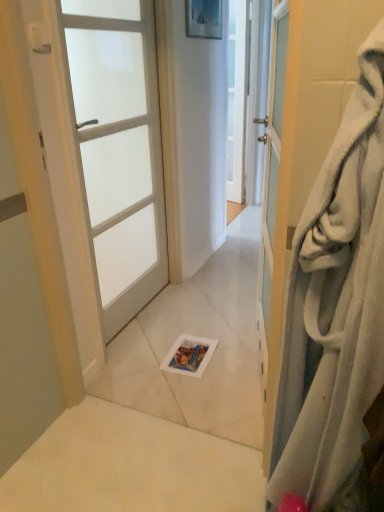
Question: Does white fabric door at right, which appears as the second door when viewed from the left, appear on the right side of white frosted glass door at left, acting as the 2th door starting from the front?

Choices:
 (A) yes
 (B) no

Answer: (A)

Question: Is white frosted glass door at left, which appears as the 2th door when viewed from the right, at the back of white fabric door at right, which appears as the second door when viewed from the left?

Choices:
 (A) yes
 (B) no

Answer: (B)

Question: Is white fabric door at right, which appears as the second door when viewed from the left, positioned far away from white frosted glass door at left, which is the first door in left-to-right order?

Choices:
 (A) yes
 (B) no

Answer: (A)

Question: Considering the relative sizes of white fabric door at right, which ranks as the 1th door in front-to-back order, and white frosted glass door at left, which is the first door in left-to-right order, in the image provided, is white fabric door at right, which ranks as the 1th door in front-to-back order, thinner than white frosted glass door at left, which is the first door in left-to-right order,?

Choices:
 (A) yes
 (B) no

Answer: (B)

Question: Is white fabric door at right, the second door viewed from the back, outside white frosted glass door at left, which appears as the 2th door when viewed from the right?

Choices:
 (A) no
 (B) yes

Answer: (B)

Question: From the image's perspective, is white fabric door at right, the second door viewed from the back, beneath white frosted glass door at left, which is the first door in left-to-right order?

Choices:
 (A) yes
 (B) no

Answer: (A)

Question: Can you confirm if white frosted glass door at left, which appears as the 2th door when viewed from the right, is shorter than white fabric door at right, the 1th door in the right-to-left sequence?

Choices:
 (A) no
 (B) yes

Answer: (A)

Question: From the image's perspective, is white frosted glass door at left, marked as the 1th door in a back-to-front arrangement, located beneath white fabric door at right, the 1th door in the right-to-left sequence?

Choices:
 (A) yes
 (B) no

Answer: (B)

Question: Can you confirm if white frosted glass door at left, which appears as the 2th door when viewed from the right, is taller than white fabric door at right, which ranks as the 1th door in front-to-back order?

Choices:
 (A) no
 (B) yes

Answer: (B)

Question: Is white fabric door at right, which ranks as the 1th door in front-to-back order, completely or partially inside white frosted glass door at left, marked as the 1th door in a back-to-front arrangement?

Choices:
 (A) yes
 (B) no

Answer: (B)

Question: From the image's perspective, is white frosted glass door at left, which appears as the 2th door when viewed from the right, on top of white fabric door at right, the second door viewed from the back?

Choices:
 (A) yes
 (B) no

Answer: (A)

Question: Is white frosted glass door at left, acting as the 2th door starting from the front, looking in the opposite direction of white fabric door at right, which appears as the second door when viewed from the left?

Choices:
 (A) yes
 (B) no

Answer: (B)

Question: Is white frosted glass door at left, which is the first door in left-to-right order, inside the boundaries of white fabric door at right, the 1th door in the right-to-left sequence, or outside?

Choices:
 (A) inside
 (B) outside

Answer: (B)